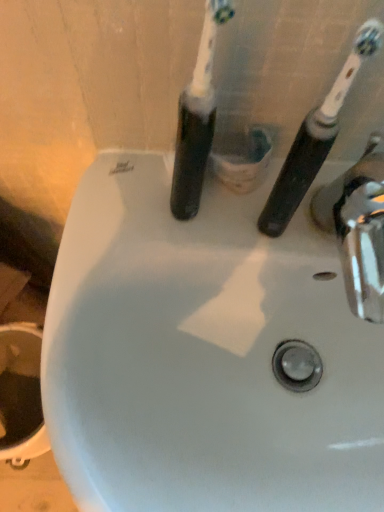
Question: Is the position of chrome metallic tap at right less distant than that of black plastic toothbrush at center, arranged as the 2th toothbrush when viewed from the right?

Choices:
 (A) yes
 (B) no

Answer: (B)

Question: Is chrome metallic tap at right at the right side of black plastic toothbrush at center, placed as the first toothbrush when sorted from left to right?

Choices:
 (A) yes
 (B) no

Answer: (A)

Question: Is chrome metallic tap at right oriented away from black plastic toothbrush at center, arranged as the 2th toothbrush when viewed from the right?

Choices:
 (A) yes
 (B) no

Answer: (B)

Question: Is chrome metallic tap at right at the left side of black plastic toothbrush at center, arranged as the 2th toothbrush when viewed from the right?

Choices:
 (A) no
 (B) yes

Answer: (A)

Question: Is chrome metallic tap at right oriented towards black plastic toothbrush at center, arranged as the 2th toothbrush when viewed from the right?

Choices:
 (A) yes
 (B) no

Answer: (B)

Question: Considering the positions of point (352, 287) and point (190, 86), is point (352, 287) closer or farther from the camera than point (190, 86)?

Choices:
 (A) closer
 (B) farther

Answer: (B)

Question: From their relative heights in the image, would you say chrome metallic tap at right is taller or shorter than black plastic toothbrush at center, placed as the first toothbrush when sorted from left to right?

Choices:
 (A) tall
 (B) short

Answer: (B)

Question: Is chrome metallic tap at right in front of or behind black plastic toothbrush at center, placed as the first toothbrush when sorted from left to right, in the image?

Choices:
 (A) behind
 (B) front

Answer: (A)

Question: In terms of size, does chrome metallic tap at right appear bigger or smaller than black plastic toothbrush at center, arranged as the 2th toothbrush when viewed from the right?

Choices:
 (A) big
 (B) small

Answer: (A)

Question: Based on their positions, is black plastic toothbrush at center, arranged as the 2th toothbrush when viewed from the right, located to the left or right of black rubber toothbrush at upper right, which appears as the first toothbrush when viewed from the right?

Choices:
 (A) left
 (B) right

Answer: (A)

Question: Which is correct: black plastic toothbrush at center, placed as the first toothbrush when sorted from left to right, is inside black rubber toothbrush at upper right, which is the 2th toothbrush in left-to-right order, or outside of it?

Choices:
 (A) inside
 (B) outside

Answer: (B)

Question: Considering their positions, is black plastic toothbrush at center, placed as the first toothbrush when sorted from left to right, located in front of or behind black rubber toothbrush at upper right, which is the 2th toothbrush in left-to-right order?

Choices:
 (A) front
 (B) behind

Answer: (A)

Question: Does point (193, 108) appear closer or farther from the camera than point (334, 137)?

Choices:
 (A) closer
 (B) farther

Answer: (A)

Question: From the image's perspective, is black rubber toothbrush at upper right, which appears as the first toothbrush when viewed from the right, positioned above or below black plastic toothbrush at center, arranged as the 2th toothbrush when viewed from the right?

Choices:
 (A) above
 (B) below

Answer: (B)

Question: Is black rubber toothbrush at upper right, which is the 2th toothbrush in left-to-right order, wider or thinner than black plastic toothbrush at center, placed as the first toothbrush when sorted from left to right?

Choices:
 (A) thin
 (B) wide

Answer: (A)